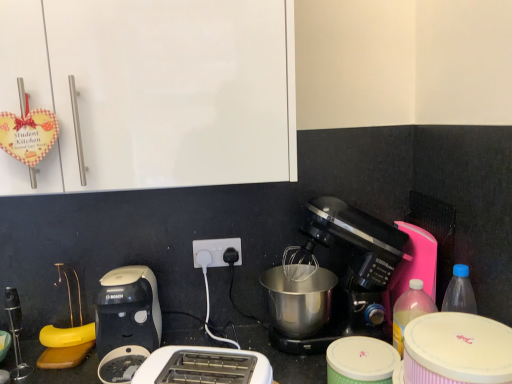
Locate an element on the screen. blank space above pink striped container at lower right, acting as the second appliance starting from the bottom (from a real-world perspective) is located at coordinates (459, 332).